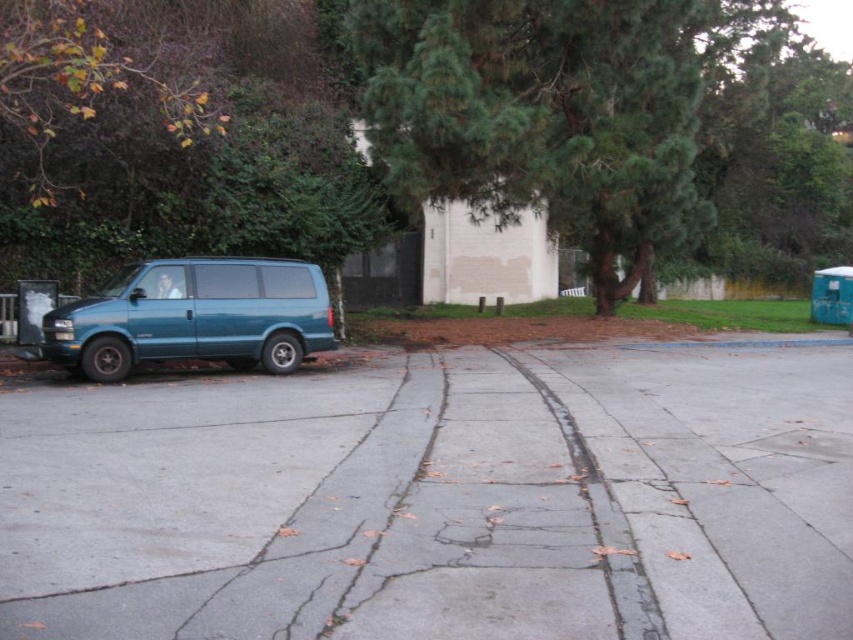
Describe the element at coordinates (427, 131) in the screenshot. I see `green leafy tree at upper center` at that location.

Who is more distant from viewer, (544, 86) or (300, 266)?

Positioned behind is point (544, 86).

Measure the distance between point [9,241] and camera.

Point [9,241] is 16.82 meters away from camera.

This screenshot has height=640, width=853. I want to click on green leafy tree at upper center, so click(x=427, y=131).

Is gray concrete pavement at center to the right of teal matte van at left from the viewer's perspective?

Indeed, gray concrete pavement at center is positioned on the right side of teal matte van at left.

Who is shorter, gray concrete pavement at center or teal matte van at left?

With less height is gray concrete pavement at center.

Does point (790, 577) come behind point (241, 356)?

No, it is not.

The height and width of the screenshot is (640, 853). Find the location of `gray concrete pavement at center`. gray concrete pavement at center is located at coordinates (442, 500).

Between gray concrete pavement at center and green leafy tree at upper center, which one is positioned lower?

Positioned lower is gray concrete pavement at center.

Between gray concrete pavement at center and green leafy tree at upper center, which one appears on the left side from the viewer's perspective?

Positioned to the left is gray concrete pavement at center.

Does point (460, 394) come in front of point (181, 3)?

Yes.

The image size is (853, 640). In order to click on gray concrete pavement at center in this screenshot , I will do `click(442, 500)`.